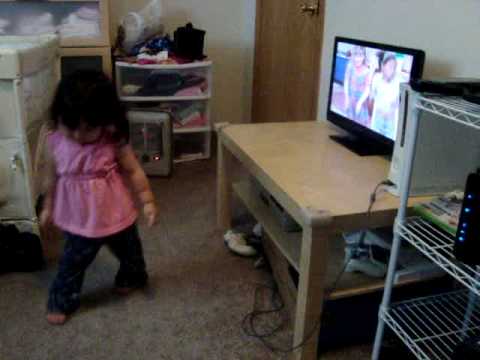
Locate an element on the screen. Image resolution: width=480 pixels, height=360 pixels. table is located at coordinates (310, 188).